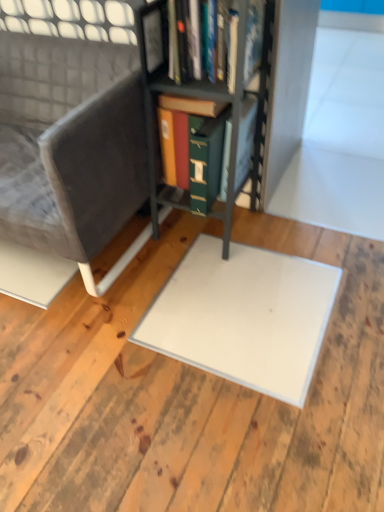
Question: Relative to white matte plywood at center, is metallic gray bookcase at center in front or behind?

Choices:
 (A) front
 (B) behind

Answer: (B)

Question: Is metallic gray bookcase at center taller or shorter than white matte plywood at center?

Choices:
 (A) short
 (B) tall

Answer: (B)

Question: Estimate the real-world distances between objects in this image. Which object is closer to the velvet grey chair at left?

Choices:
 (A) metallic gray bookcase at center
 (B) white matte plywood at center

Answer: (A)

Question: Which object is positioned closest to the velvet grey chair at left?

Choices:
 (A) white matte plywood at center
 (B) metallic gray bookcase at center

Answer: (B)